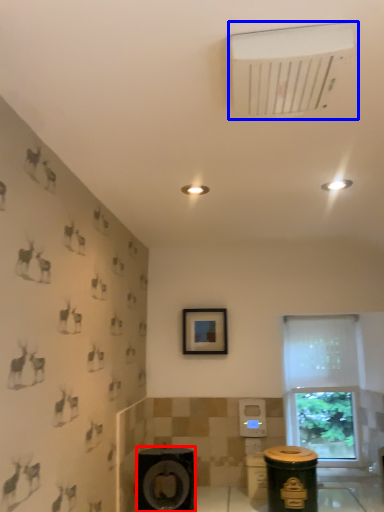
Question: Which point is closer to the camera, speaker (highlighted by a red box) or air conditioning (highlighted by a blue box)?

Choices:
 (A) speaker
 (B) air conditioning

Answer: (B)